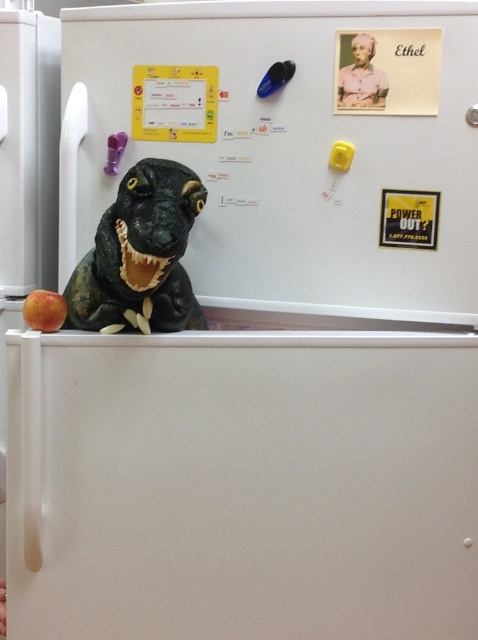
Can you confirm if shiny plastic dinosaur at center is positioned to the right of red matte apple at lower left?

Yes, shiny plastic dinosaur at center is to the right of red matte apple at lower left.

Which is more to the left, shiny plastic dinosaur at center or red matte apple at lower left?

Positioned to the left is red matte apple at lower left.

Identify the location of shiny plastic dinosaur at center. This screenshot has height=640, width=478. (141, 252).